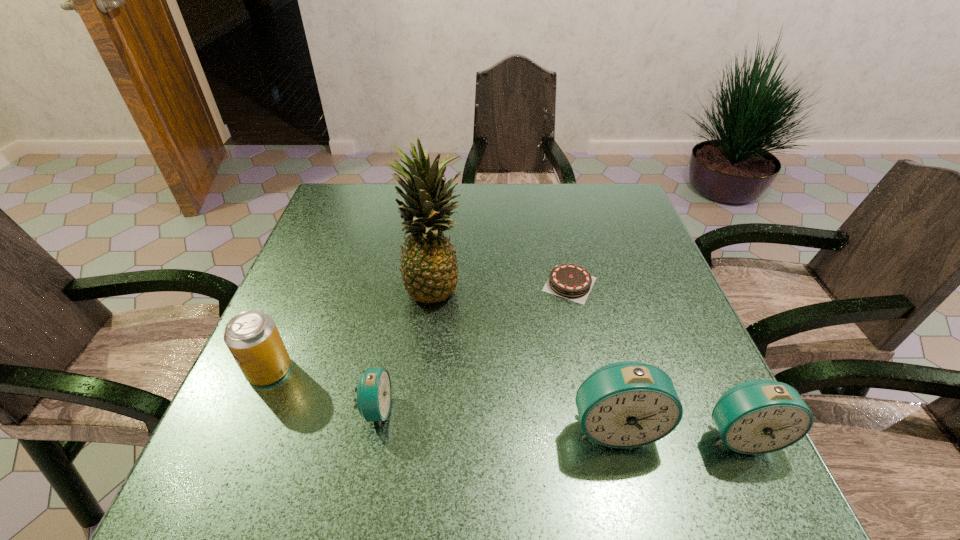
Please point a location where one more alarm_clock can be added evenly. Please provide its 2D coordinates. Your answer should be formatted as a tuple, i.e. [(x, y)], where the tuple contains the x and y coordinates of a point satisfying the conditions above.

[(493, 417)]